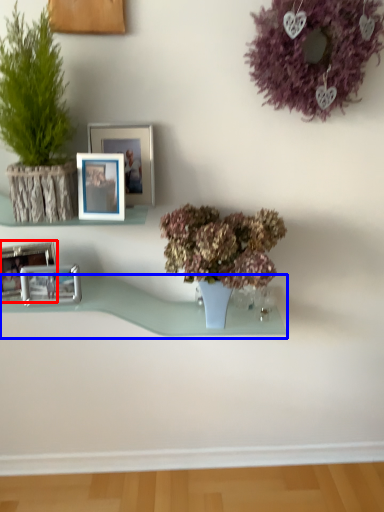
Question: Which of the following is the closest to the observer, picture frame (highlighted by a red box) or window sill (highlighted by a blue box)?

Choices:
 (A) picture frame
 (B) window sill

Answer: (A)